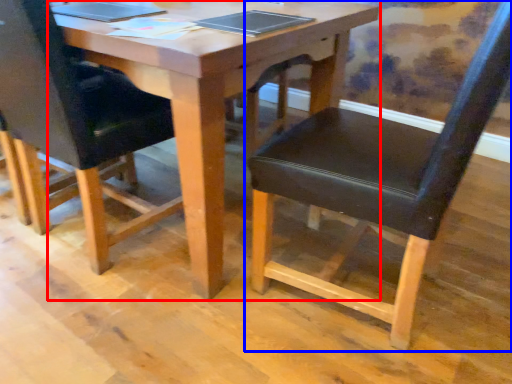
Question: Which of the following is the closest to the observer, table (highlighted by a red box) or chair (highlighted by a blue box)?

Choices:
 (A) table
 (B) chair

Answer: (B)